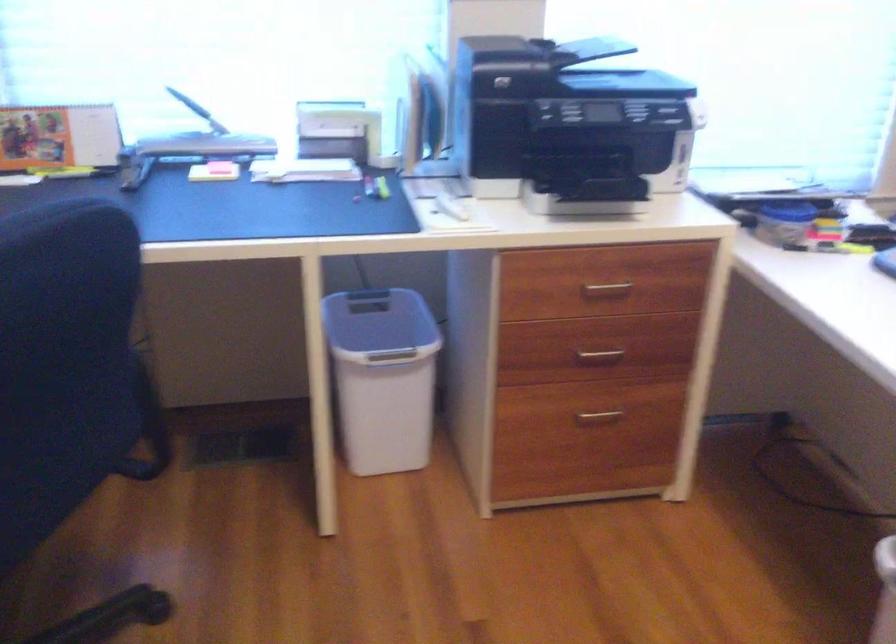
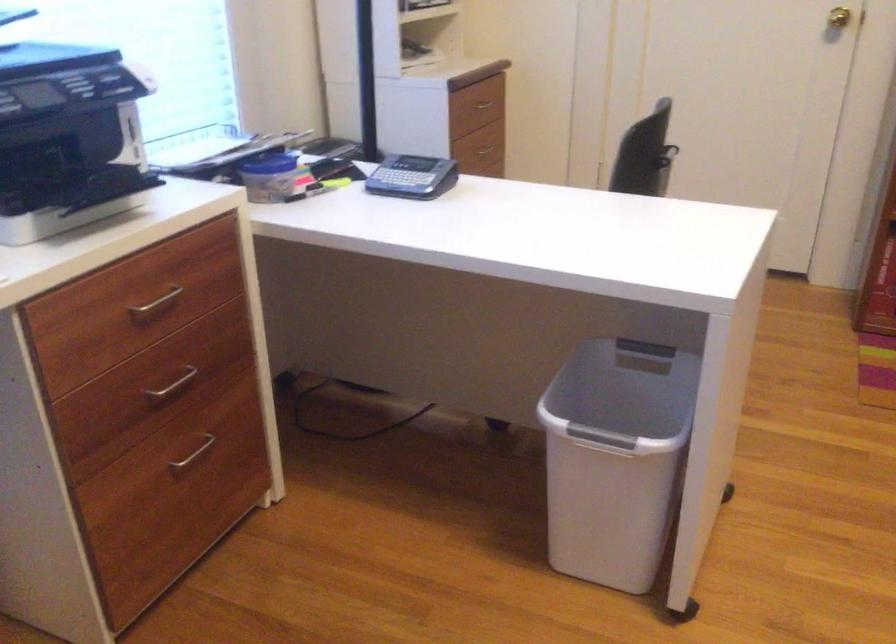
Locate, in the second image, the point that corresponds to (x=779, y=212) in the first image.

(270, 164)